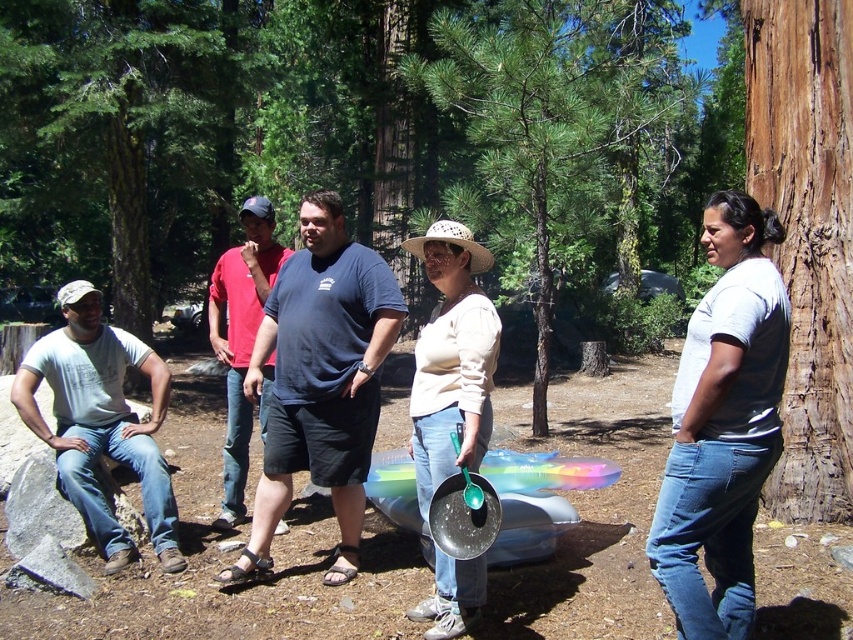
Which is more to the right, green leafy tree at center or gray cotton shirt at left?

From the viewer's perspective, green leafy tree at center appears more on the right side.

Is green leafy tree at center taller than gray cotton shirt at left?

Yes, green leafy tree at center is taller than gray cotton shirt at left.

In order to click on green leafy tree at center in this screenshot , I will do `click(558, 134)`.

Who is shorter, brown rough bark at right or white matte shirt at center?

Standing shorter between the two is white matte shirt at center.

What do you see at coordinates (807, 234) in the screenshot? The height and width of the screenshot is (640, 853). I see `brown rough bark at right` at bounding box center [807, 234].

Describe the element at coordinates (807, 234) in the screenshot. I see `brown rough bark at right` at that location.

Identify the location of brown rough bark at right. (807, 234).

Does dark blue t-shirt at center have a lesser height compared to white matte shirt at center?

No, dark blue t-shirt at center is not shorter than white matte shirt at center.

I want to click on dark blue t-shirt at center, so click(320, 380).